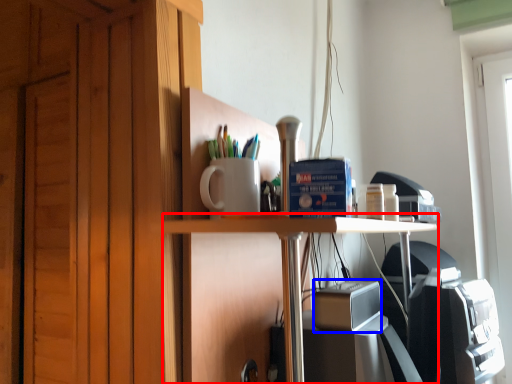
Question: Which object is further to the camera taking this photo, table (highlighted by a red box) or appliance (highlighted by a blue box)?

Choices:
 (A) table
 (B) appliance

Answer: (B)